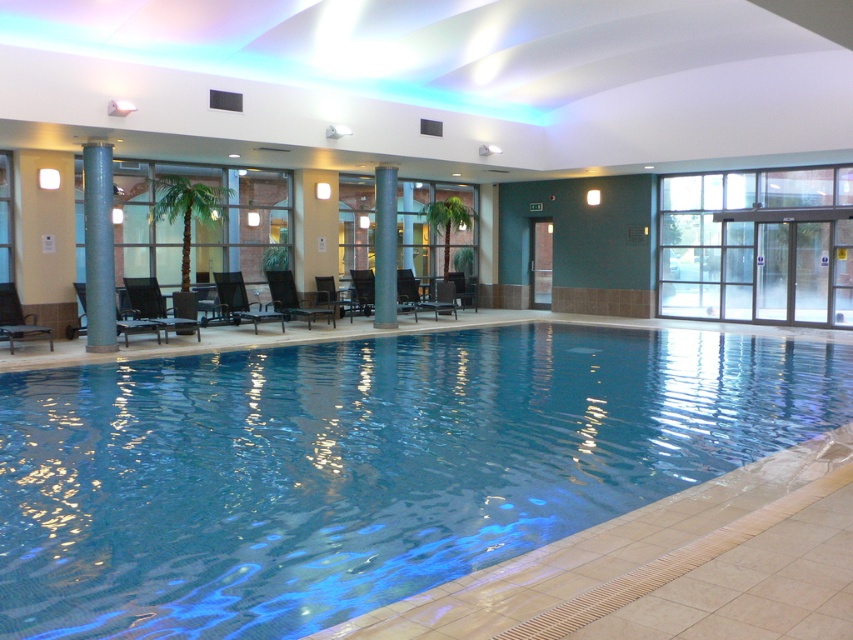
You are standing at the point marked as point (106, 232) in the image. You want to swim to the pool edge which is 10 feet away from you. Is the pool edge within your reach?

The distance between you and the pool edge is 45.15 feet, which is greater than 10 feet, so the pool edge is not within your reach.

You are designing a layout for a poolside area and need to place a large potted plant between the matte black lounge chair at lower left and the metallic silver chair at center. Given their sizes, which chair should the plant be closer to?

The matte black lounge chair at lower left is larger in size compared to the metallic silver chair at center, so the plant should be placed closer to the metallic silver chair at center to balance the space.

You are planning to place a new rectangular table that is 1.2 meters wide between the smooth gray column at center and the dark brown leather chair at center. Based on the space between them, will the table fit without touching either object?

The smooth gray column at center has a lesser width compared to dark brown leather chair at center. Since the table is 1.2 meters wide, it depends on the actual distance between the two objects. However, the description only mentions their widths, not the space between them. Therefore, we cannot determine if the table will fit based on the provided information.